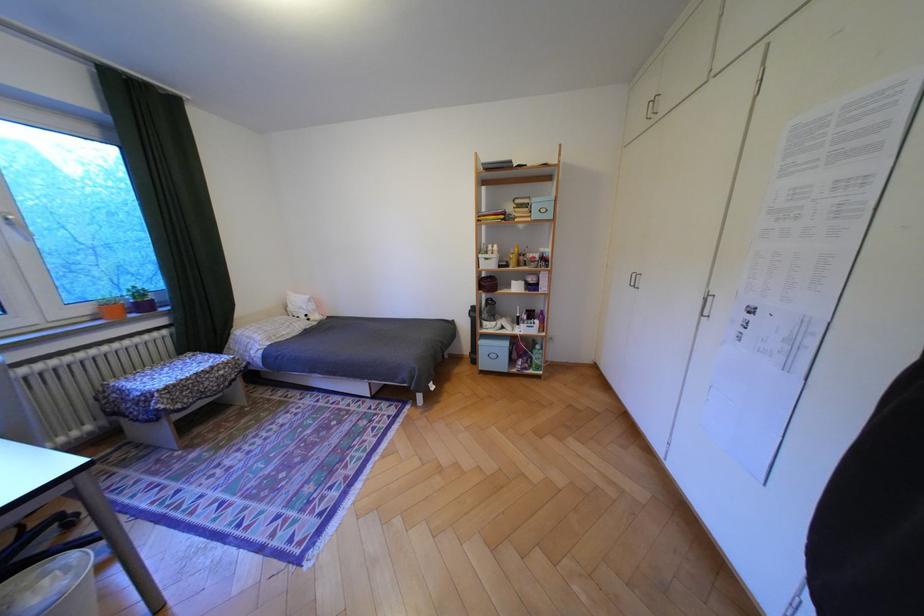
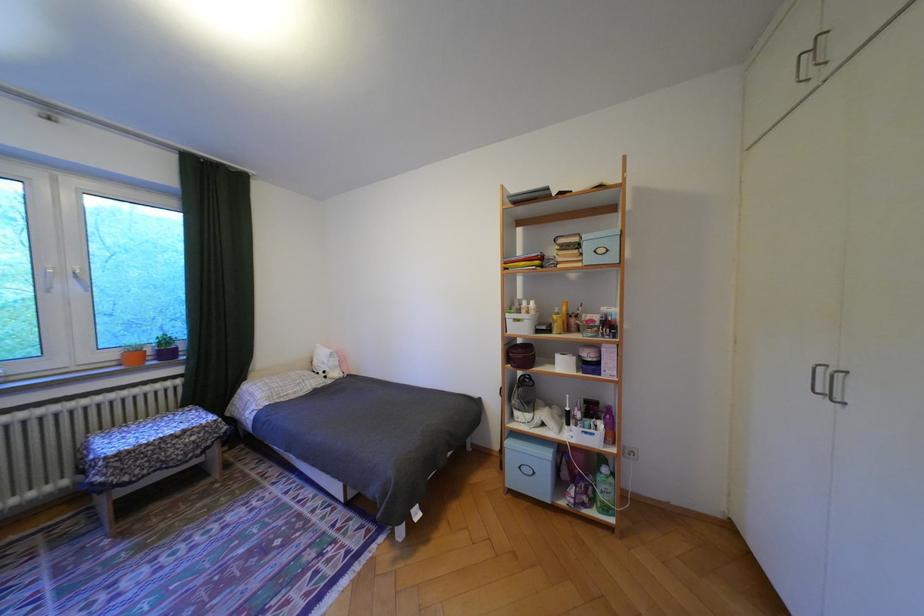
Locate, in the second image, the point that corresponds to the point at 520,286 in the first image.

(564, 362)